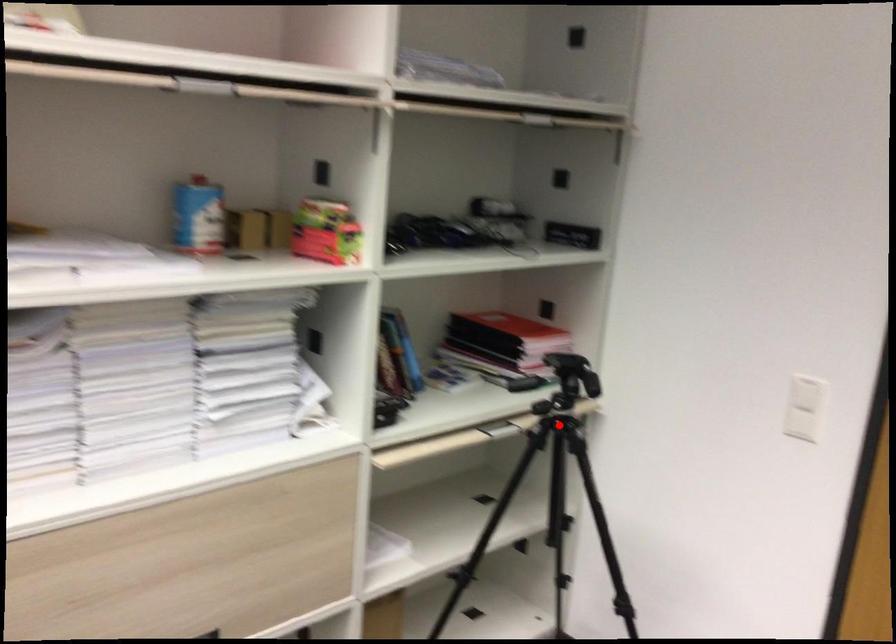
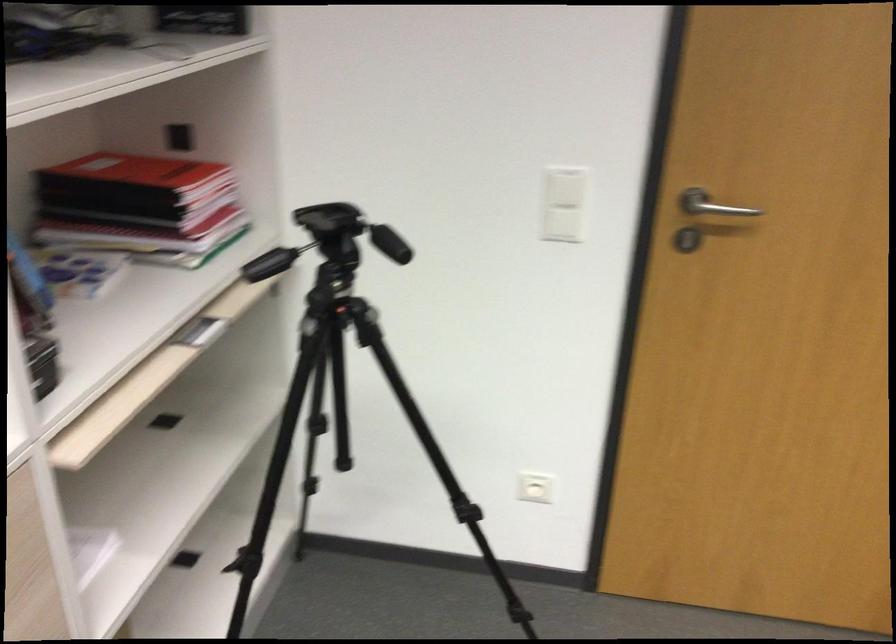
Question: I am providing you with two images of the same scene from different viewpoints. A red point is shown in image1. For the corresponding object point in image2, is it positioned nearer or farther from the camera?

Choices:
 (A) Nearer
 (B) Farther

Answer: (A)